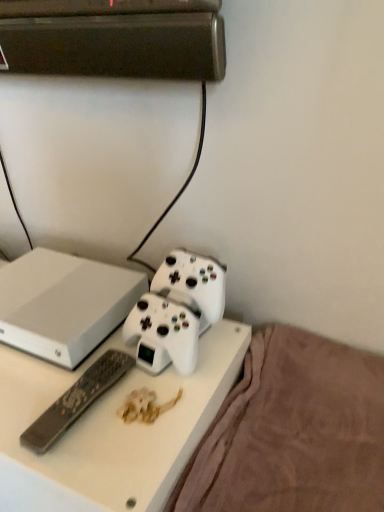
What are the coordinates of `free space to the right of black plastic remote at lower left` in the screenshot? It's located at (155, 407).